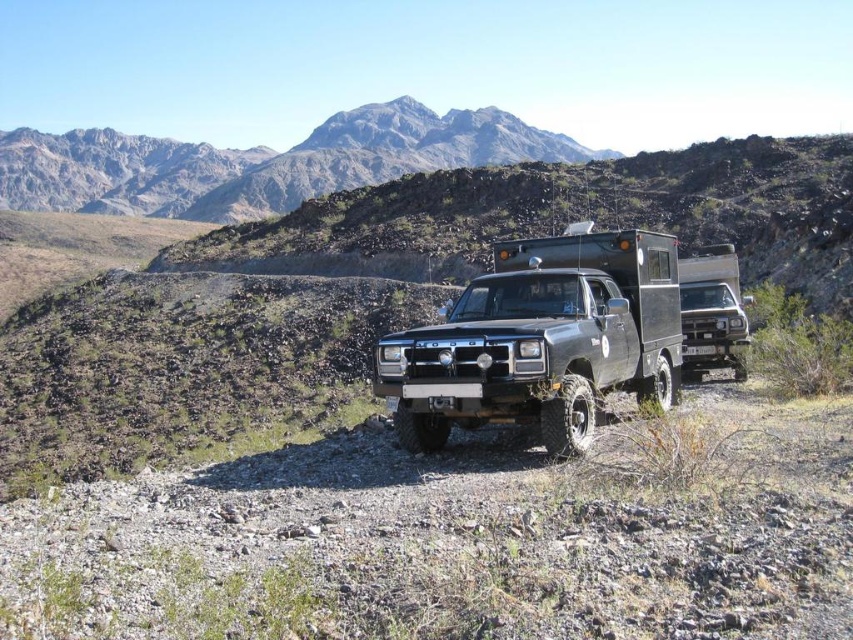
Does black matte truck at center appear on the right side of rugged granite mountain at upper center?

Yes, black matte truck at center is to the right of rugged granite mountain at upper center.

Which is in front, point (442, 387) or point (558, 138)?

Point (442, 387) is more forward.

Who is more distant from viewer, (416, 340) or (331, 188)?

Positioned behind is point (331, 188).

Locate an element on the screen. The height and width of the screenshot is (640, 853). black matte truck at center is located at coordinates (541, 340).

Is black matte truck at center in front of matte black truck at right?

Yes, black matte truck at center is closer to the viewer.

What do you see at coordinates (541, 340) in the screenshot? This screenshot has height=640, width=853. I see `black matte truck at center` at bounding box center [541, 340].

Locate an element on the screen. The image size is (853, 640). black matte truck at center is located at coordinates (541, 340).

Can you confirm if rugged granite mountain at upper center is shorter than matte black truck at right?

In fact, rugged granite mountain at upper center may be taller than matte black truck at right.

Is rugged granite mountain at upper center positioned behind matte black truck at right?

That is True.

The height and width of the screenshot is (640, 853). I want to click on rugged granite mountain at upper center, so [x=262, y=163].